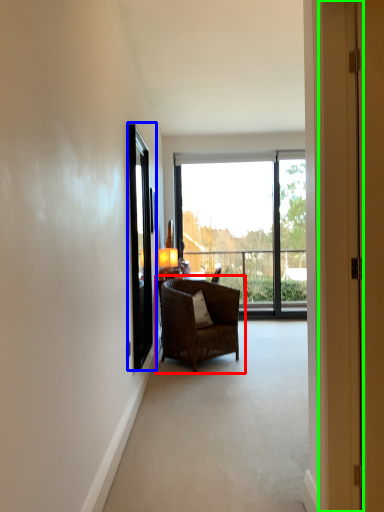
Question: Estimate the real-world distances between objects in this image. Which object is closer to chair (highlighted by a red box), screen door (highlighted by a blue box) or door (highlighted by a green box)?

Choices:
 (A) screen door
 (B) door

Answer: (A)